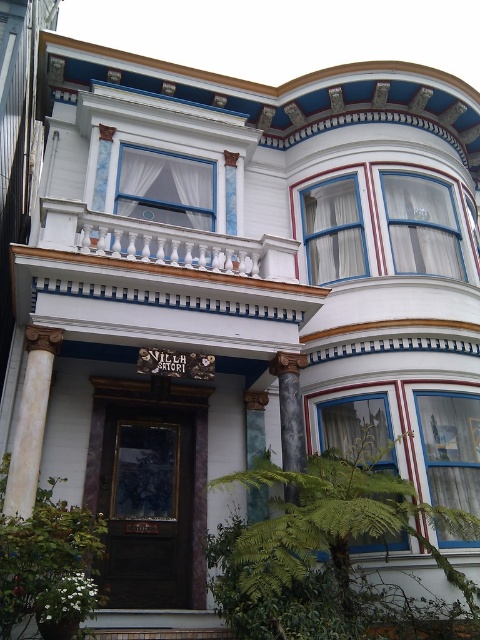
Question: Does matte white window at upper right have a lesser width compared to matte white curtain at upper right?

Choices:
 (A) yes
 (B) no

Answer: (B)

Question: Estimate the real-world distances between objects in this image. Which object is farther from the clear glass window at center?

Choices:
 (A) clear glass window at right
 (B) matte white window at upper right

Answer: (B)

Question: Is white painted wood at upper center thinner than matte white curtain at upper right?

Choices:
 (A) yes
 (B) no

Answer: (B)

Question: Can you confirm if green leafy fern at lower right is positioned to the left of clear glass window at center?

Choices:
 (A) no
 (B) yes

Answer: (B)

Question: Which object is the closest to the green leafy fern at lower right?

Choices:
 (A) white marble column at left
 (B) clear glass window at right

Answer: (B)

Question: Which of the following is the closest to the observer?

Choices:
 (A) (334, 243)
 (B) (424, 269)
 (C) (192, 208)

Answer: (C)